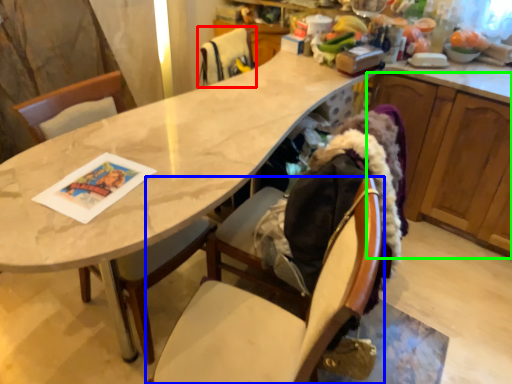
Question: Estimate the real-world distances between objects in this image. Which object is closer to chair (highlighted by a red box), chair (highlighted by a blue box) or cabinetry (highlighted by a green box)?

Choices:
 (A) chair
 (B) cabinetry

Answer: (B)